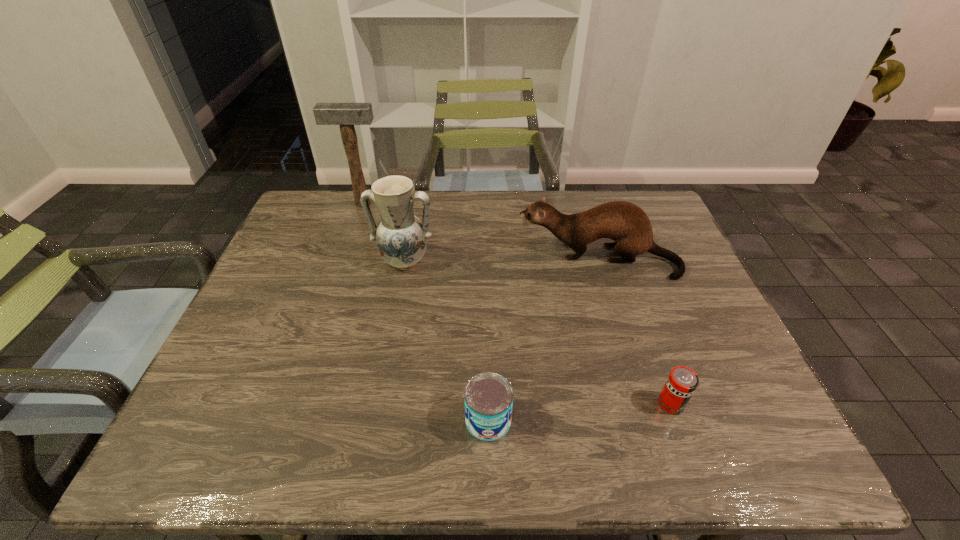
Locate an element on the screen. The height and width of the screenshot is (540, 960). empty space that is in between the left can and the fourth object from right to left is located at coordinates (446, 341).

At what (x,y) coordinates should I click in order to perform the action: click on free spot between the second tallest object and the right can. Please return your answer as a coordinate pair (x, y). Looking at the image, I should click on (538, 333).

This screenshot has width=960, height=540. I want to click on vacant point located between the ferret and the mallet, so click(x=480, y=231).

Find the location of a particular element. The width and height of the screenshot is (960, 540). object that is the closest to the third object from left to right is located at coordinates (682, 381).

Identify the location of object that is the second closest to the ferret. (682, 381).

You are a GUI agent. You are given a task and a screenshot of the screen. Output one action in this format:
    pyautogui.click(x=<x>, y=<y>)
    Task: Click on the free location that satisfies the following two spatial constraints: 1. at the face of the right can; 2. on the right side of the third shortest object
    
    Given the screenshot: What is the action you would take?
    pyautogui.click(x=641, y=404)

You are a GUI agent. You are given a task and a screenshot of the screen. Output one action in this format:
    pyautogui.click(x=<x>, y=<y>)
    Task: Click on the free space that satisfies the following two spatial constraints: 1. on the front side of the tallest object; 2. on the left side of the third object from right to left
    This screenshot has height=540, width=960.
    Given the screenshot: What is the action you would take?
    pyautogui.click(x=287, y=420)

This screenshot has height=540, width=960. In order to click on free region that satisfies the following two spatial constraints: 1. at the face of the ferret; 2. on the left side of the right can in this screenshot , I will do `click(641, 404)`.

Locate an element on the screen. The image size is (960, 540). free location that satisfies the following two spatial constraints: 1. on the back side of the right can; 2. at the face of the third shortest object is located at coordinates (620, 259).